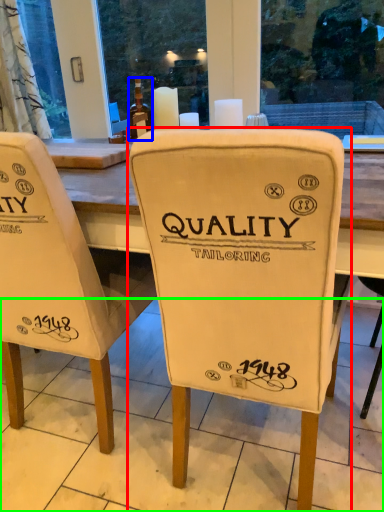
Question: Based on their relative distances, which object is nearer to chair (highlighted by a red box)? Choose from bottle (highlighted by a blue box) and tile (highlighted by a green box).

Choices:
 (A) bottle
 (B) tile

Answer: (B)